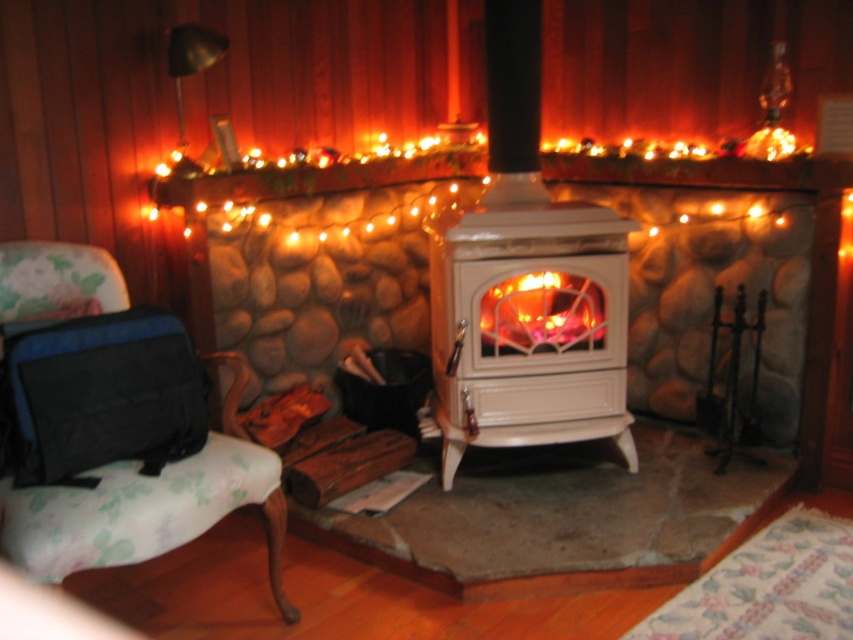
You are a guest who just entered the living room and wants to sit down. You see the floral fabric armchair at left and the orange glowing wood at center. Which one is a better option for seating?

The floral fabric armchair at left is much taller than the orange glowing wood at center, so it is a better option for seating since it is designed for sitting.